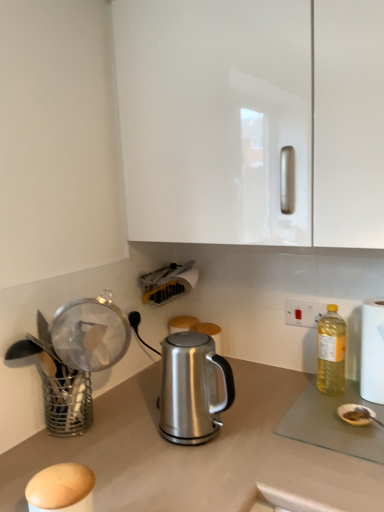
Question: From the image's perspective, is yellow translucent bottle at right on white paper towel at right?

Choices:
 (A) no
 (B) yes

Answer: (B)

Question: Does yellow translucent bottle at right lie behind white paper towel at right?

Choices:
 (A) yes
 (B) no

Answer: (A)

Question: Is yellow translucent bottle at right positioned far away from white paper towel at right?

Choices:
 (A) yes
 (B) no

Answer: (B)

Question: Considering the relative sizes of yellow translucent bottle at right and white paper towel at right in the image provided, is yellow translucent bottle at right taller than white paper towel at right?

Choices:
 (A) yes
 (B) no

Answer: (B)

Question: Is yellow translucent bottle at right placed right next to white paper towel at right?

Choices:
 (A) no
 (B) yes

Answer: (A)

Question: Is yellow translucent bottle at right thinner than white paper towel at right?

Choices:
 (A) no
 (B) yes

Answer: (B)

Question: Does yellow translucent bottle at right come behind satin silver kettle at center?

Choices:
 (A) no
 (B) yes

Answer: (B)

Question: Are yellow translucent bottle at right and satin silver kettle at center beside each other?

Choices:
 (A) no
 (B) yes

Answer: (A)

Question: Considering the relative sizes of yellow translucent bottle at right and satin silver kettle at center in the image provided, is yellow translucent bottle at right taller than satin silver kettle at center?

Choices:
 (A) no
 (B) yes

Answer: (B)

Question: Can satin silver kettle at center be found inside yellow translucent bottle at right?

Choices:
 (A) no
 (B) yes

Answer: (A)

Question: Are yellow translucent bottle at right and satin silver kettle at center located far from each other?

Choices:
 (A) yes
 (B) no

Answer: (B)

Question: Is yellow translucent bottle at right completely or partially outside of satin silver kettle at center?

Choices:
 (A) yes
 (B) no

Answer: (A)

Question: Does white plastic electric outlet at upper right turn towards white glossy cabinet at upper center?

Choices:
 (A) yes
 (B) no

Answer: (B)